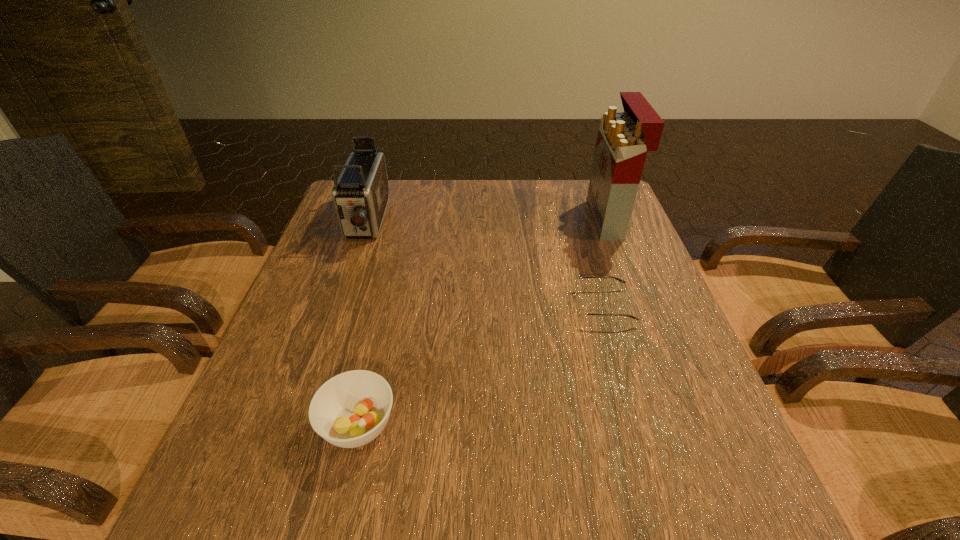
Locate an element on the screen. The image size is (960, 540). unoccupied area between the soup bowl and the second nearest object is located at coordinates (481, 366).

Find the location of `free space between the camcorder and the soup bowl`. free space between the camcorder and the soup bowl is located at coordinates (362, 323).

This screenshot has height=540, width=960. I want to click on vacant point located between the second tallest object and the nearest object, so click(362, 323).

In order to click on free point between the tallest object and the nearest object in this screenshot , I will do `click(483, 322)`.

Identify the location of unoccupied position between the cigarette case and the camcorder. (487, 220).

Where is `free spot between the nearest object and the camcorder`? The width and height of the screenshot is (960, 540). free spot between the nearest object and the camcorder is located at coordinates (362, 323).

The height and width of the screenshot is (540, 960). In order to click on vacant space that's between the second shortest object and the third shortest object in this screenshot , I will do `click(362, 323)`.

Select which object appears as the second closest to the tallest object. Please provide its 2D coordinates. Your answer should be formatted as a tuple, i.e. [(x, y)], where the tuple contains the x and y coordinates of a point satisfying the conditions above.

[(360, 194)]

Where is `object that is the third closest to the camcorder`? Image resolution: width=960 pixels, height=540 pixels. object that is the third closest to the camcorder is located at coordinates (624, 138).

The height and width of the screenshot is (540, 960). In order to click on free space that satisfies the following two spatial constraints: 1. at the lens of the nearest object; 2. on the left side of the third shortest object in this screenshot , I will do `click(296, 425)`.